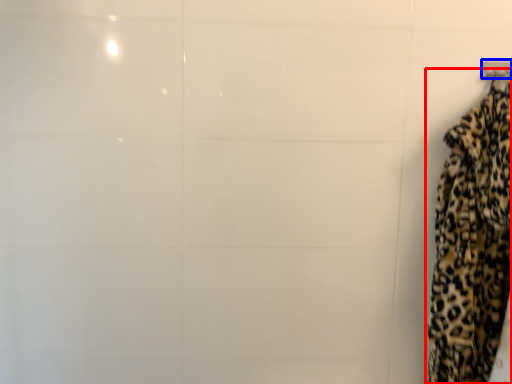
Question: Which point is further to the camera, curtain (highlighted by a red box) or hanger (highlighted by a blue box)?

Choices:
 (A) curtain
 (B) hanger

Answer: (B)